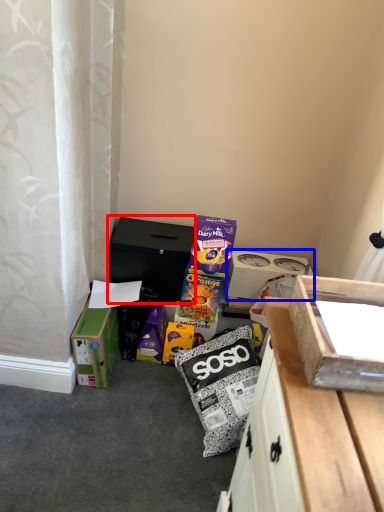
Question: Which of the following is the closest to the observer, cardboard box (highlighted by a red box) or box (highlighted by a blue box)?

Choices:
 (A) cardboard box
 (B) box

Answer: (A)